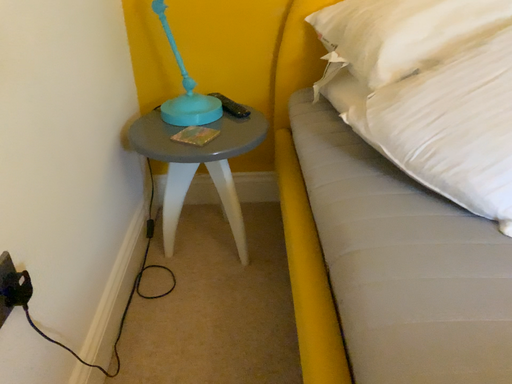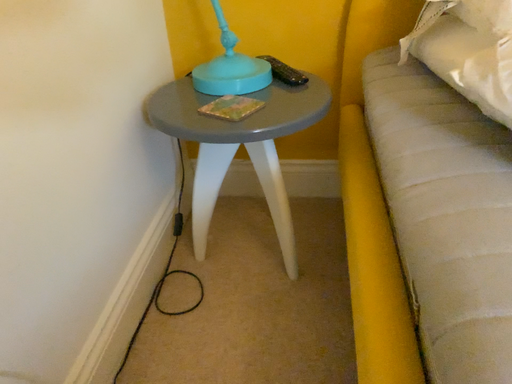
Question: Which way did the camera rotate in the video?

Choices:
 (A) rotated right
 (B) rotated left

Answer: (B)